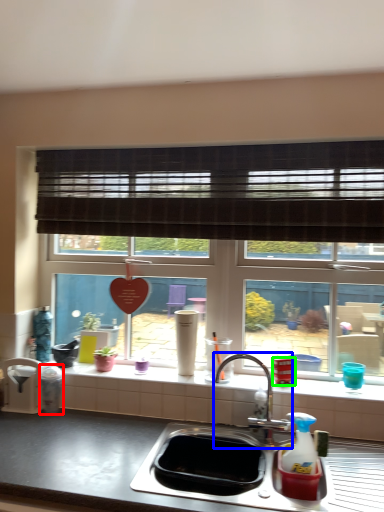
Question: Which object is positioned closest to appliance (highlighted by a red box)? Select from tap (highlighted by a blue box) and appliance (highlighted by a green box).

Choices:
 (A) tap
 (B) appliance

Answer: (A)